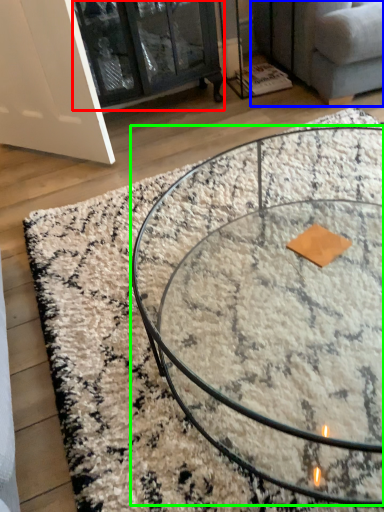
Question: Which is nearer to the glass door (highlighted by a red box)? studio couch (highlighted by a blue box) or coffee table (highlighted by a green box).

Choices:
 (A) studio couch
 (B) coffee table

Answer: (A)